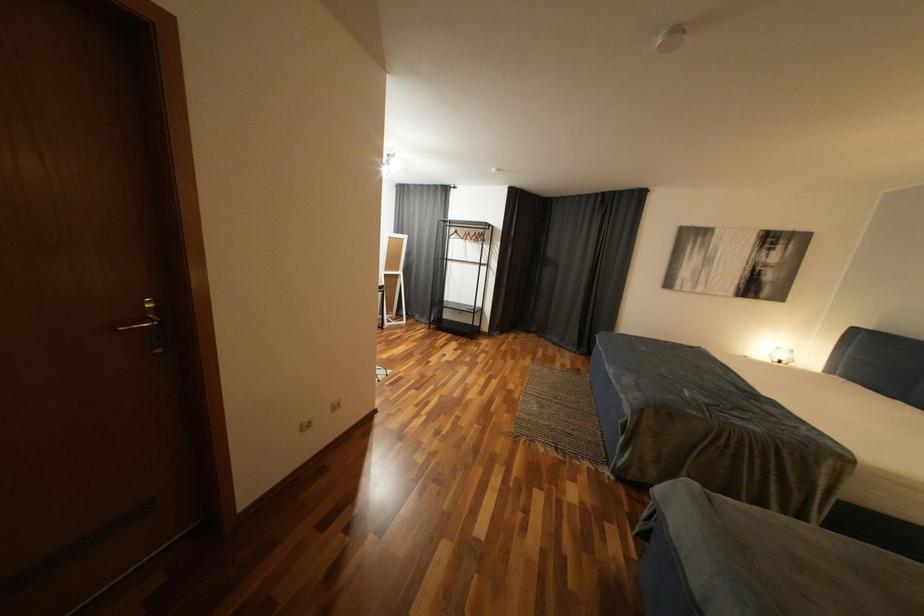
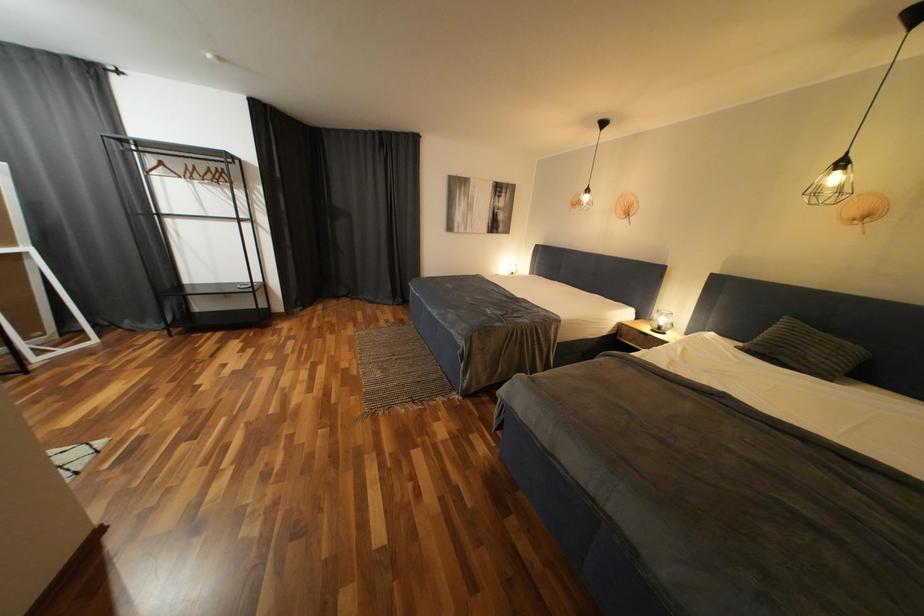
Question: The camera is either moving clockwise (left) or counter-clockwise (right) around the object. The first image is from the beginning of the video and the second image is from the end. Is the camera moving left or right when shooting the video?

Choices:
 (A) Left
 (B) Right

Answer: (A)